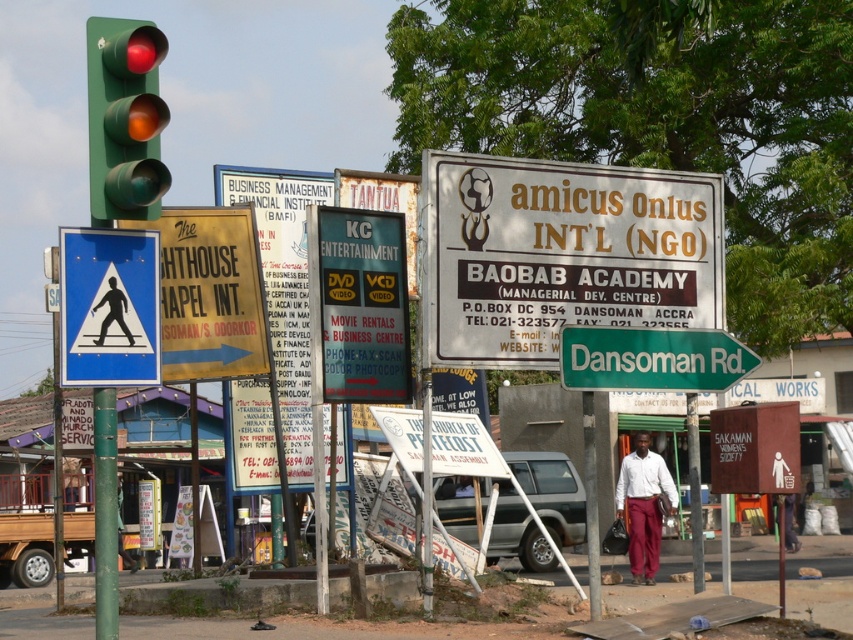
Question: Is matte black signboard at center closer to camera compared to green matte traffic light at upper left?

Choices:
 (A) yes
 (B) no

Answer: (B)

Question: Observing the image, what is the correct spatial positioning of green metallic signpost at right in reference to green painted metal pole at left?

Choices:
 (A) above
 (B) below

Answer: (A)

Question: Which object is positioned farthest from the matte black signboard at center?

Choices:
 (A) green matte traffic light at upper left
 (B) white paper sign at center
 (C) green metallic signpost at right
 (D) green painted metal pole at left

Answer: (A)

Question: Estimate the real-world distances between objects in this image. Which object is closer to the blue plastic pedestrian crossing sign at left?

Choices:
 (A) green matte traffic light at upper left
 (B) white paper sign at center

Answer: (A)

Question: Which point is farther to the camera?

Choices:
 (A) matte black signboard at center
 (B) blue plastic pedestrian crossing sign at left

Answer: (A)

Question: Is matte black signboard at center smaller than blue plastic pedestrian crossing sign at left?

Choices:
 (A) no
 (B) yes

Answer: (A)